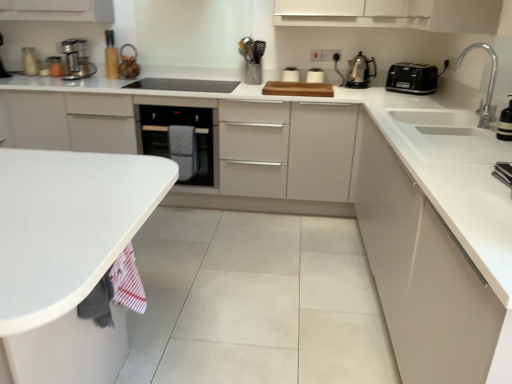
Question: Should I look upward or downward to see metallic silver toaster at upper right, the 5th appliance in the left-to-right sequence?

Choices:
 (A) down
 (B) up

Answer: (B)

Question: Considering the relative sizes of metallic stainless steel coffee maker at left, which is counted as the first kitchen appliance, starting from the left, and polished stainless steel kettle at upper right, placed as the second kitchen appliance when sorted from left to right, in the image provided, is metallic stainless steel coffee maker at left, which is counted as the first kitchen appliance, starting from the left, smaller than polished stainless steel kettle at upper right, placed as the second kitchen appliance when sorted from left to right,?

Choices:
 (A) no
 (B) yes

Answer: (A)

Question: Is metallic stainless steel coffee maker at left, which is counted as the first kitchen appliance, starting from the left, positioned beyond the bounds of polished stainless steel kettle at upper right, placed as the second kitchen appliance when sorted from left to right?

Choices:
 (A) yes
 (B) no

Answer: (A)

Question: From the image's perspective, is metallic stainless steel coffee maker at left, marked as the third kitchen appliance in a right-to-left arrangement, on polished stainless steel kettle at upper right, which is counted as the 2th kitchen appliance, starting from the right?

Choices:
 (A) no
 (B) yes

Answer: (B)

Question: Is metallic stainless steel coffee maker at left, which is counted as the first kitchen appliance, starting from the left, to the right of polished stainless steel kettle at upper right, which is counted as the 2th kitchen appliance, starting from the right, from the viewer's perspective?

Choices:
 (A) yes
 (B) no

Answer: (B)

Question: Are metallic stainless steel coffee maker at left, which is counted as the first kitchen appliance, starting from the left, and polished stainless steel kettle at upper right, placed as the second kitchen appliance when sorted from left to right, far apart?

Choices:
 (A) no
 (B) yes

Answer: (B)

Question: From a real-world perspective, is metallic stainless steel coffee maker at left, marked as the third kitchen appliance in a right-to-left arrangement, on polished stainless steel kettle at upper right, placed as the second kitchen appliance when sorted from left to right?

Choices:
 (A) no
 (B) yes

Answer: (B)

Question: Is black glass cooktop at center, which is the 3th appliance in front-to-back order, at the left side of metallic stainless steel coffee maker at left, which is counted as the first kitchen appliance, starting from the left?

Choices:
 (A) no
 (B) yes

Answer: (A)

Question: Considering the relative sizes of black glass cooktop at center, positioned as the fourth appliance in top-to-bottom order, and metallic stainless steel coffee maker at left, marked as the third kitchen appliance in a right-to-left arrangement, in the image provided, is black glass cooktop at center, positioned as the fourth appliance in top-to-bottom order, thinner than metallic stainless steel coffee maker at left, marked as the third kitchen appliance in a right-to-left arrangement,?

Choices:
 (A) no
 (B) yes

Answer: (A)

Question: Is black glass cooktop at center, which is the 3th appliance in front-to-back order, directly adjacent to metallic stainless steel coffee maker at left, which is counted as the first kitchen appliance, starting from the left?

Choices:
 (A) no
 (B) yes

Answer: (A)

Question: From a real-world perspective, is black glass cooktop at center, positioned as the fourth appliance in top-to-bottom order, on metallic stainless steel coffee maker at left, marked as the third kitchen appliance in a right-to-left arrangement?

Choices:
 (A) yes
 (B) no

Answer: (B)

Question: Can you confirm if black glass cooktop at center, which is the 6th appliance in right-to-left order, is smaller than metallic stainless steel coffee maker at left, which is counted as the first kitchen appliance, starting from the left?

Choices:
 (A) yes
 (B) no

Answer: (A)

Question: Considering the relative sizes of black glass cooktop at center, which is the 3th appliance in front-to-back order, and metallic stainless steel coffee maker at left, marked as the third kitchen appliance in a right-to-left arrangement, in the image provided, is black glass cooktop at center, which is the 3th appliance in front-to-back order, wider than metallic stainless steel coffee maker at left, marked as the third kitchen appliance in a right-to-left arrangement,?

Choices:
 (A) yes
 (B) no

Answer: (A)

Question: Is black plastic toaster at upper right, the 1th kitchen appliance when ordered from right to left, turned away from polished stainless steel kettle at upper right, placed as the second kitchen appliance when sorted from left to right?

Choices:
 (A) yes
 (B) no

Answer: (B)